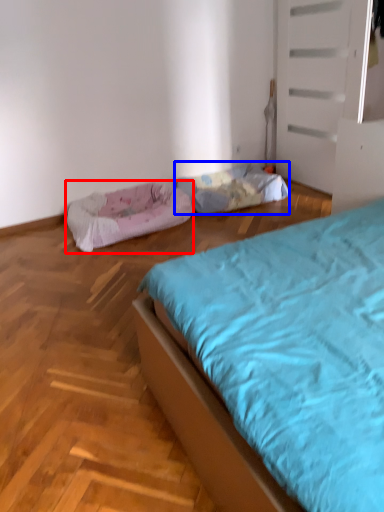
Question: Which of the following is the farthest to the observer, dog bed (highlighted by a red box) or blanket (highlighted by a blue box)?

Choices:
 (A) dog bed
 (B) blanket

Answer: (B)